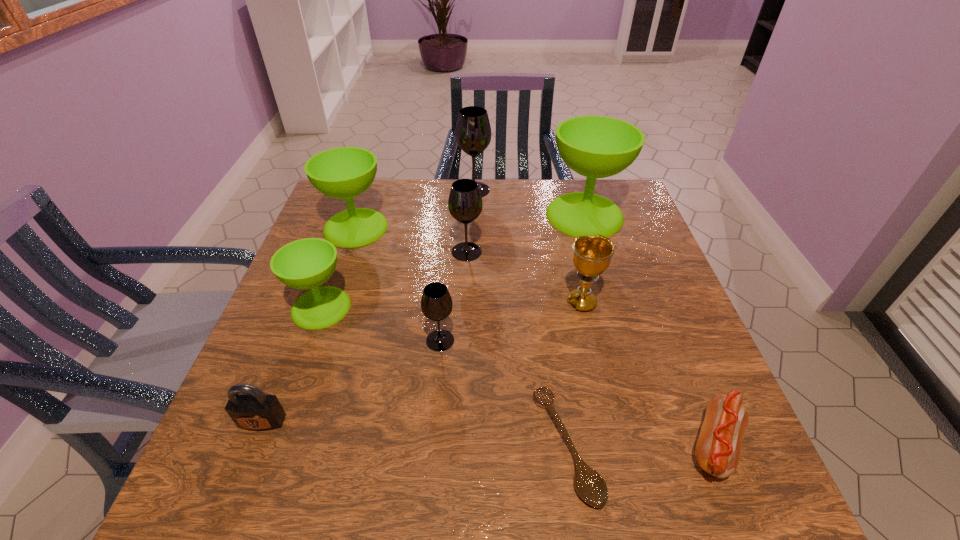
Image resolution: width=960 pixels, height=540 pixels. What are the coordinates of `the biggest gray wineglass` in the screenshot? It's located at (473, 131).

At what (x,y) coordinates should I click in order to perform the action: click on the biggest green wineglass. Please return your answer as a coordinate pair (x, y). Image resolution: width=960 pixels, height=540 pixels. Looking at the image, I should click on (595, 147).

The height and width of the screenshot is (540, 960). Find the location of `the rightmost wineglass`. the rightmost wineglass is located at coordinates (595, 147).

In order to click on the second biggest green wineglass in this screenshot , I will do `click(345, 172)`.

Locate an element on the screen. the second smallest gray wineglass is located at coordinates (465, 203).

At what (x,y) coordinates should I click in order to perform the action: click on gold chalice. Please return your answer as a coordinate pair (x, y). Looking at the image, I should click on coord(591,254).

At what (x,y) coordinates should I click in order to perform the action: click on the nearest green wineglass. Please return your answer as a coordinate pair (x, y). Looking at the image, I should click on (307, 263).

Identify the location of the nearest gray wineglass. (436, 303).

This screenshot has height=540, width=960. In order to click on padlock in this screenshot , I will do `click(250, 408)`.

Locate an element on the screen. the third shortest object is located at coordinates (250, 408).